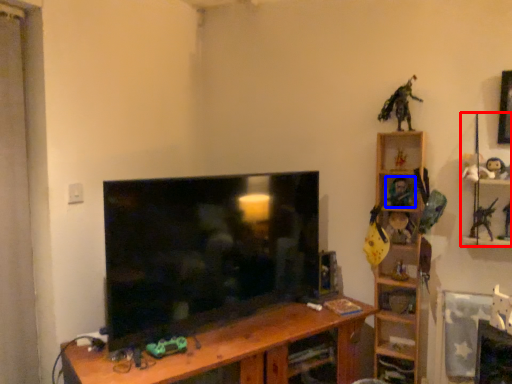
Question: Which of the following is the farthest to the observer, toy (highlighted by a red box) or toy (highlighted by a blue box)?

Choices:
 (A) toy
 (B) toy

Answer: (B)